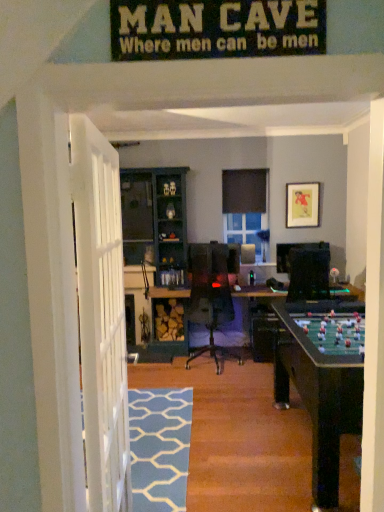
The width and height of the screenshot is (384, 512). What are the coordinates of `blank area beneath blue textured rug at lower center (from a real-world perspective)` in the screenshot? It's located at (153, 446).